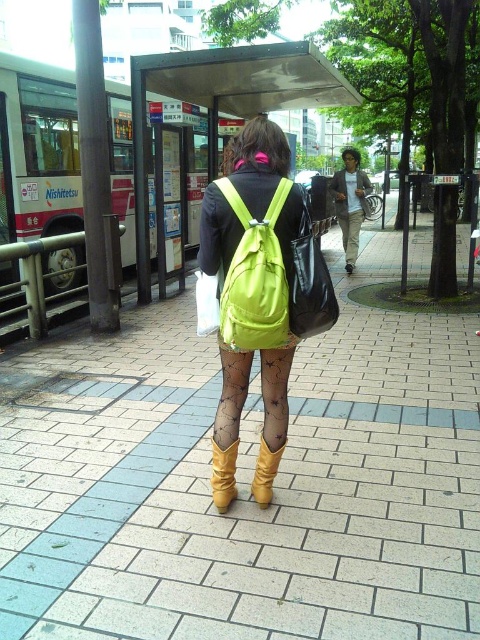
Question: Among these points, which one is nearest to the camera?

Choices:
 (A) (358, 218)
 (B) (217, 428)
 (C) (140, 248)

Answer: (B)

Question: Does metallic silver bus stop at upper center appear on the right side of black lace tights at center?

Choices:
 (A) yes
 (B) no

Answer: (A)

Question: Observing the image, what is the correct spatial positioning of matte yellow boot at center in reference to leather high-heeled boot at center?

Choices:
 (A) left
 (B) right

Answer: (A)

Question: Among these points, which one is farthest from the camera?

Choices:
 (A) (216, 416)
 (B) (222, 452)

Answer: (A)

Question: Does metallic silver bus stop at upper center have a lesser width compared to matte khaki pants at center?

Choices:
 (A) no
 (B) yes

Answer: (A)

Question: Which object is farther from the camera taking this photo?

Choices:
 (A) black lace tights at center
 (B) metallic silver bus stop at upper center
 (C) leather high-heeled boot at center

Answer: (B)